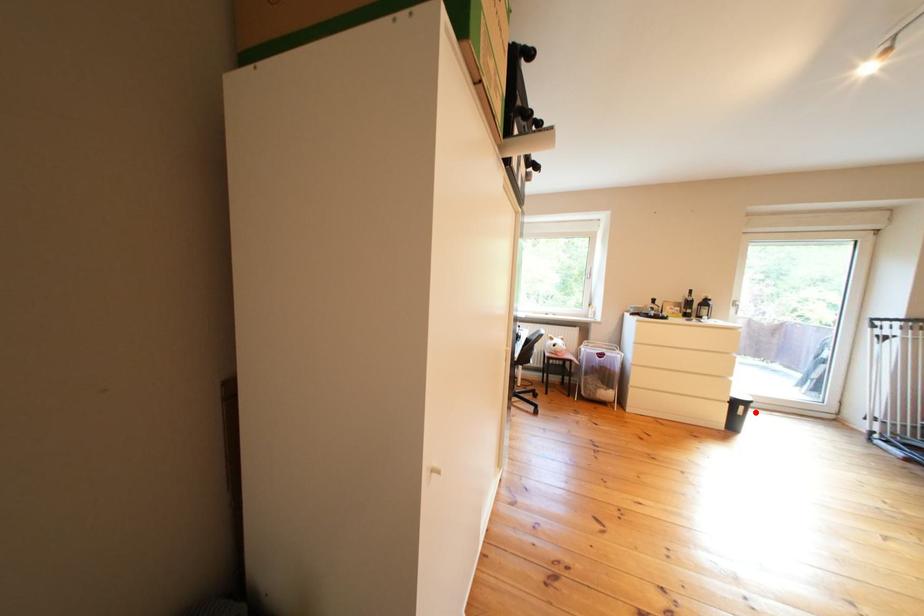
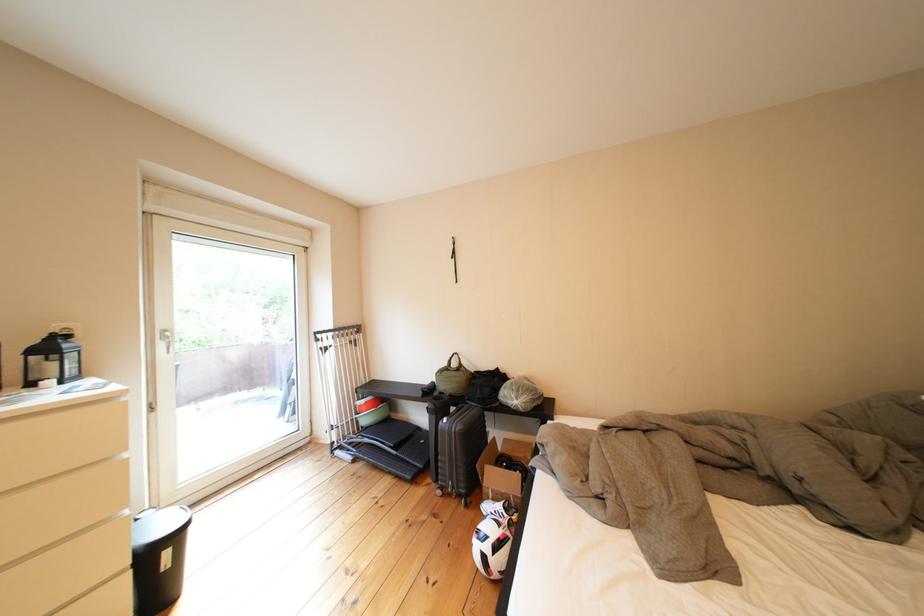
The point at the highlighted location is marked in the first image. Where is the corresponding point in the second image?

(179, 557)